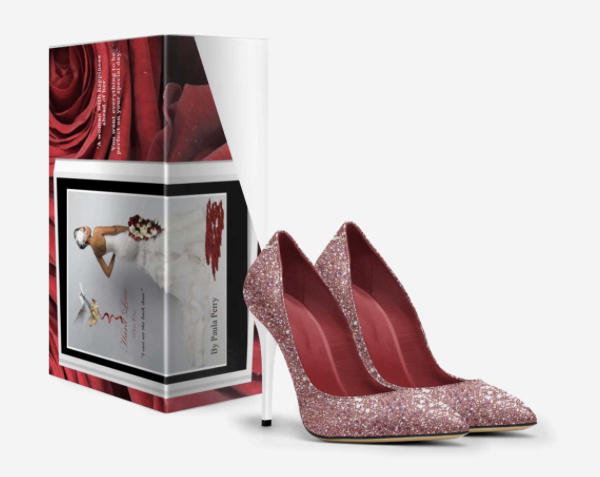
The width and height of the screenshot is (600, 477). In order to click on bouquet in this screenshot , I will do `click(144, 229)`.